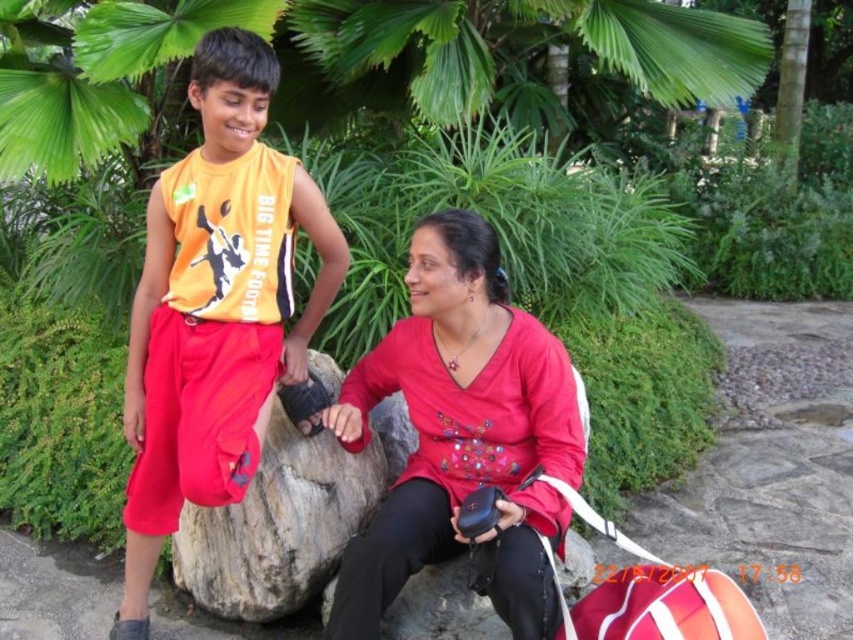
Does matte red blouse at center have a lesser width compared to rough textured rock at center?

No.

Who is lower down, matte red blouse at center or rough textured rock at center?

rough textured rock at center is below.

Locate an element on the screen. This screenshot has width=853, height=640. matte red blouse at center is located at coordinates (461, 433).

Find the location of a particular element. The image size is (853, 640). matte red blouse at center is located at coordinates (x=461, y=433).

Between point (187, 177) and point (248, 538), which one is positioned in front?

Positioned in front is point (187, 177).

Between point (229, 132) and point (282, 422), which one is positioned behind?

Point (282, 422)

In order to click on orange jersey at upper left in this screenshot , I will do `click(215, 307)`.

Between orange jersey at upper left and matte red blouse at center, which one appears on the left side from the viewer's perspective?

From the viewer's perspective, orange jersey at upper left appears more on the left side.

Looking at this image, is orange jersey at upper left smaller than matte red blouse at center?

Incorrect, orange jersey at upper left is not smaller in size than matte red blouse at center.

Who is more distant from viewer, (216,138) or (390,390)?

The point (390,390) is more distant.

At what (x,y) coordinates should I click in order to perform the action: click on orange jersey at upper left. Please return your answer as a coordinate pair (x, y). The width and height of the screenshot is (853, 640). Looking at the image, I should click on (215, 307).